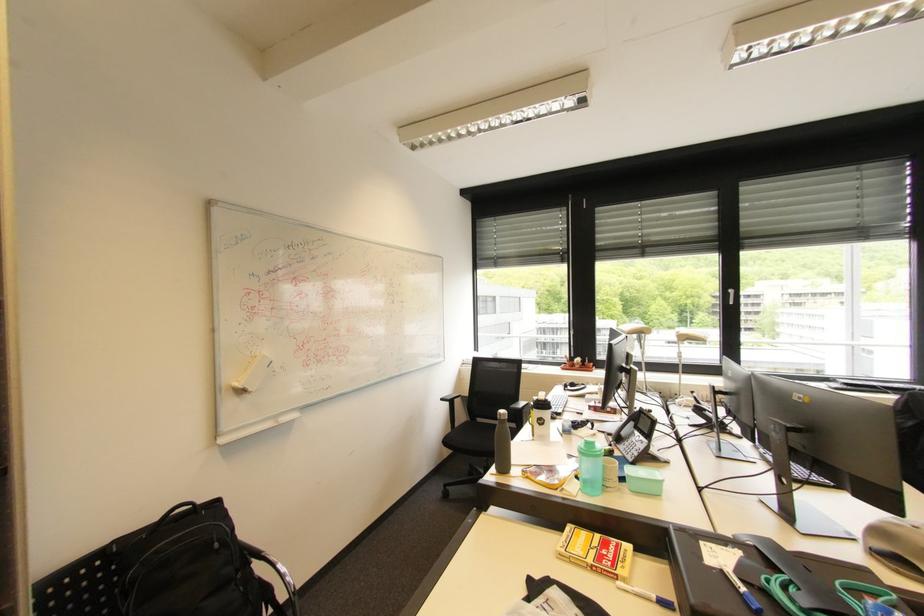
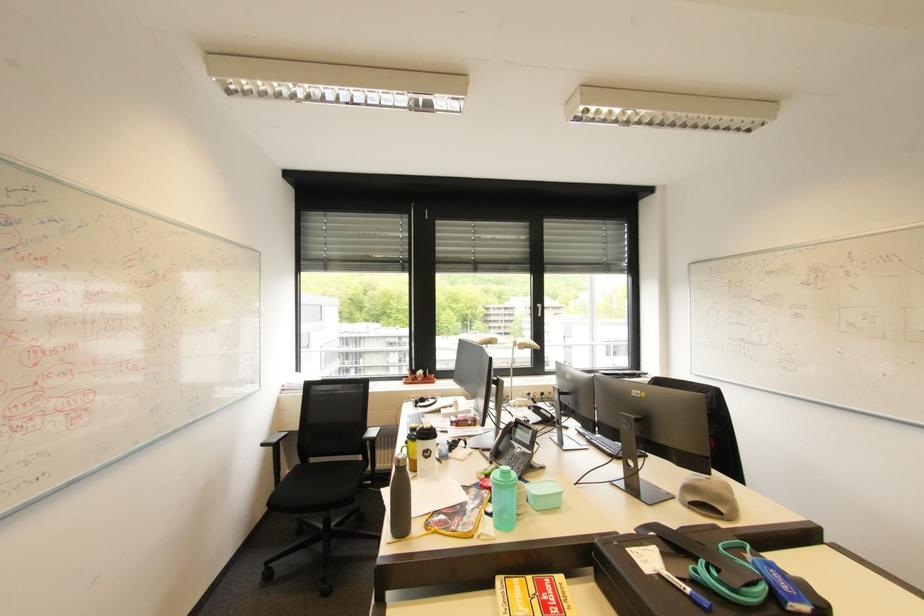
In the second image, find the point that corresponds to (748,582) in the first image.

(685, 581)